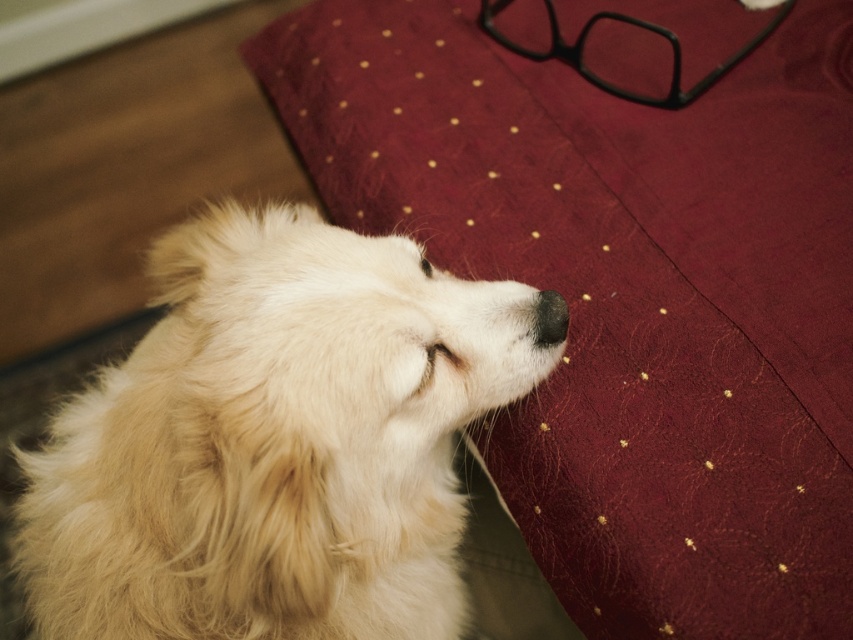
Does burgundy textured blanket at upper right have a greater width compared to black matte nose at center?

Correct, the width of burgundy textured blanket at upper right exceeds that of black matte nose at center.

Between burgundy textured blanket at upper right and black matte nose at center, which one appears on the left side from the viewer's perspective?

Positioned to the left is black matte nose at center.

At what (x,y) coordinates should I click in order to perform the action: click on burgundy textured blanket at upper right. Please return your answer as a coordinate pair (x, y). This screenshot has width=853, height=640. Looking at the image, I should click on coord(625,294).

Is fluffy white dog at center to the right of black matte nose at center from the viewer's perspective?

No, fluffy white dog at center is not to the right of black matte nose at center.

Is point (276, 376) farther from viewer compared to point (556, 321)?

No, it is in front of (556, 321).

Find the location of a particular element. The height and width of the screenshot is (640, 853). fluffy white dog at center is located at coordinates (276, 442).

Can you confirm if burgundy textured blanket at upper right is positioned to the right of fluffy white dog at center?

Yes, burgundy textured blanket at upper right is to the right of fluffy white dog at center.

Based on the photo, who is more distant from viewer, (788,576) or (532,294)?

The point (788,576) is behind.

This screenshot has height=640, width=853. What are the coordinates of `burgundy textured blanket at upper right` in the screenshot? It's located at (625, 294).